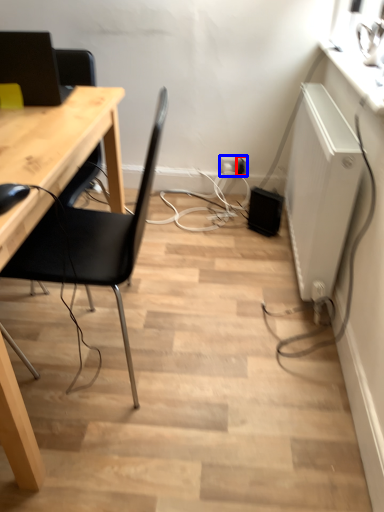
Question: Among these objects, which one is nearest to the camera, electric outlet (highlighted by a red box) or electric outlet (highlighted by a blue box)?

Choices:
 (A) electric outlet
 (B) electric outlet

Answer: (A)